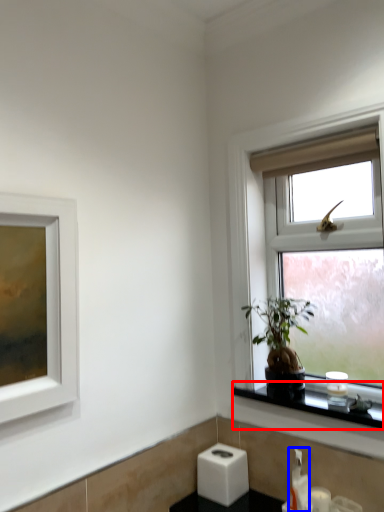
Question: Which object is closer to the camera taking this photo, window sill (highlighted by a red box) or soap dispenser (highlighted by a blue box)?

Choices:
 (A) window sill
 (B) soap dispenser

Answer: (A)